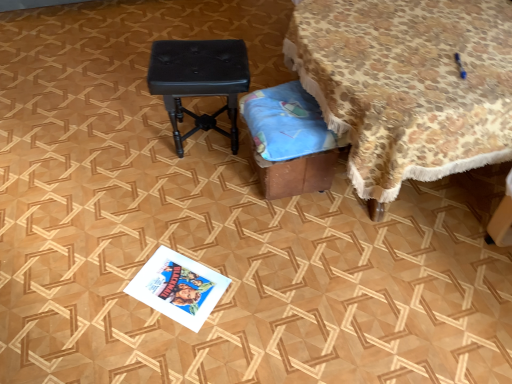
This screenshot has height=384, width=512. What are the coordinates of `vacant area that lies in front of black leather stool at center` in the screenshot? It's located at point(193,188).